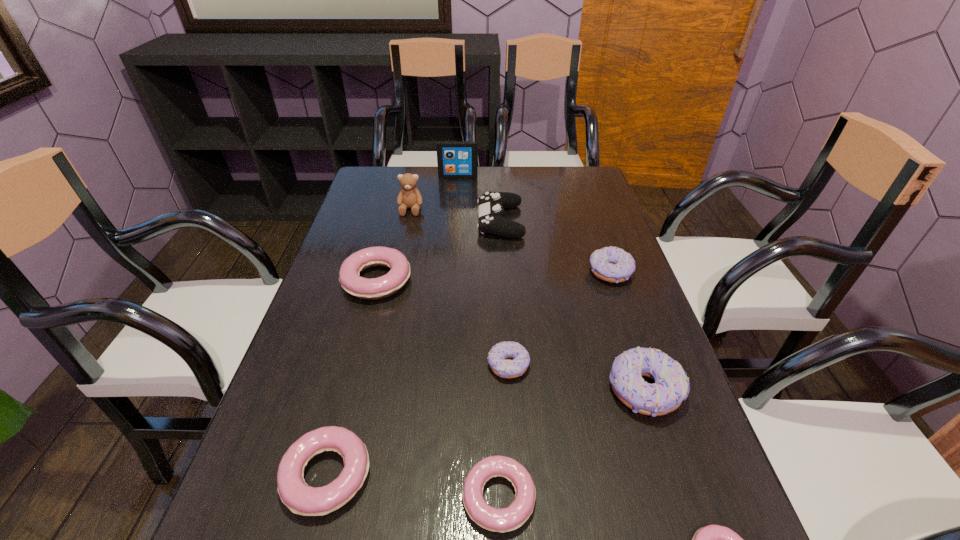
Identify the location of vacant area situated 0.360m on the front-facing side of the brown teddy bear. Image resolution: width=960 pixels, height=540 pixels. (392, 297).

Identify the location of vacant space situated 0.350m on the surface of the control. (363, 221).

At what (x,y) coordinates should I click in order to perform the action: click on vacant area located 0.080m on the surface of the control. Please return your answer as a coordinate pair (x, y). This screenshot has width=960, height=540. Looking at the image, I should click on pos(451,221).

I want to click on free location located 0.180m on the surface of the control, so click(419, 221).

I want to click on free spot located 0.340m on the left of the biggest brown doughnut, so click(439, 390).

In order to click on free space located 0.280m on the back of the biggest pink doughnut in this screenshot , I will do `click(396, 204)`.

Where is `vacant space located on the back of the farthest brown doughnut`? vacant space located on the back of the farthest brown doughnut is located at coordinates (598, 237).

Where is `blank area located on the right of the second biggest pink doughnut`? This screenshot has height=540, width=960. blank area located on the right of the second biggest pink doughnut is located at coordinates (469, 475).

Image resolution: width=960 pixels, height=540 pixels. I want to click on free spot located on the left of the smallest brown doughnut, so click(299, 366).

At what (x,y) coordinates should I click in order to perform the action: click on free region located on the back of the third biggest pink doughnut. Please return your answer as a coordinate pair (x, y). The width and height of the screenshot is (960, 540). Looking at the image, I should click on (494, 374).